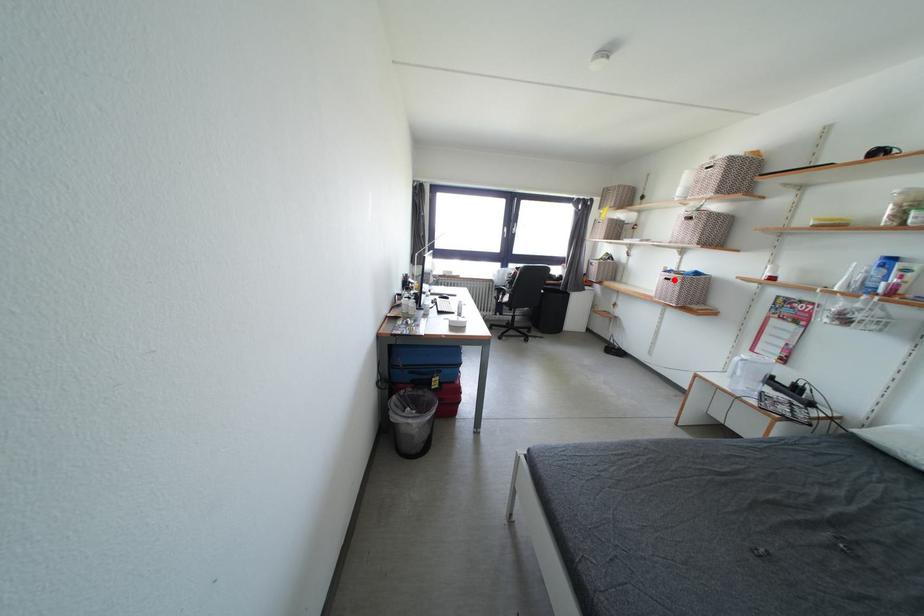
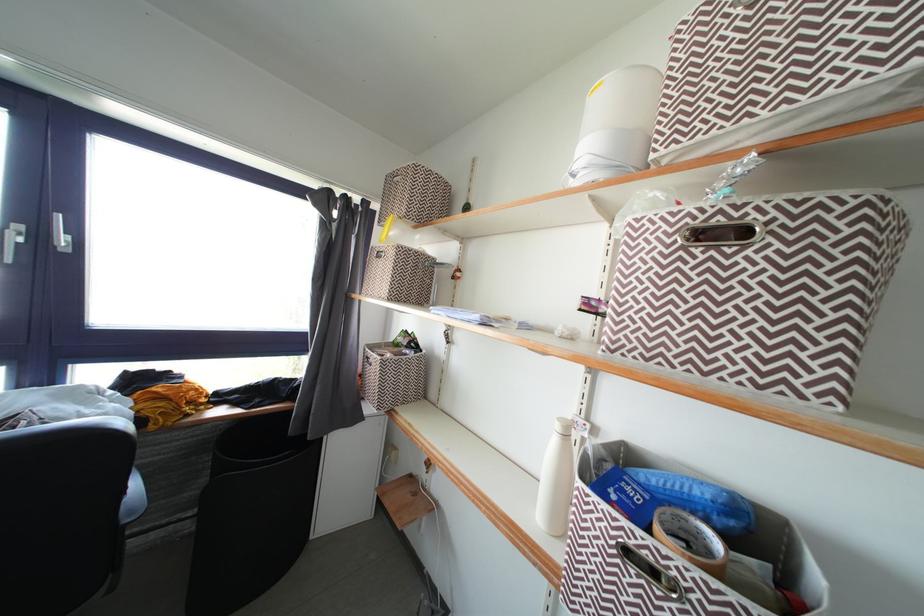
Question: A red point is marked in image1. In image2, is the corresponding 3D point closer to the camera or farther? Reply with the corresponding letter.

Choices:
 (A) The corresponding 3D point is closer.
 (B) The corresponding 3D point is farther.

Answer: (B)